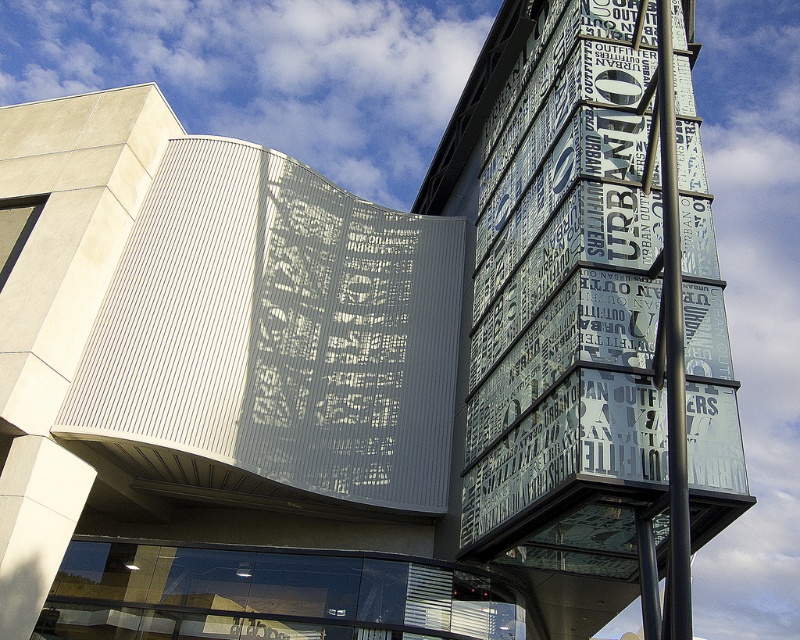
You are a delivery person trying to locate the entrance to the building. You see the transparent glass sign at upper right and the metallic pole at center. Which object is bigger and can help you find the entrance more easily?

The transparent glass sign at upper right is larger than the metallic pole at center, so it can help you find the entrance more easily.

What are the coordinates of the transparent glass sign at upper right?

The transparent glass sign at upper right is located at coordinates point (566, 304).

You are standing in front of the building and want to take a photo of both the transparent glass sign at upper right and the metallic pole at center. Which object should you frame first in your camera to ensure both are in the shot?

The transparent glass sign at upper right might be wider than metallic pole at center, so you should frame the transparent glass sign at upper right first to ensure both are in the shot.